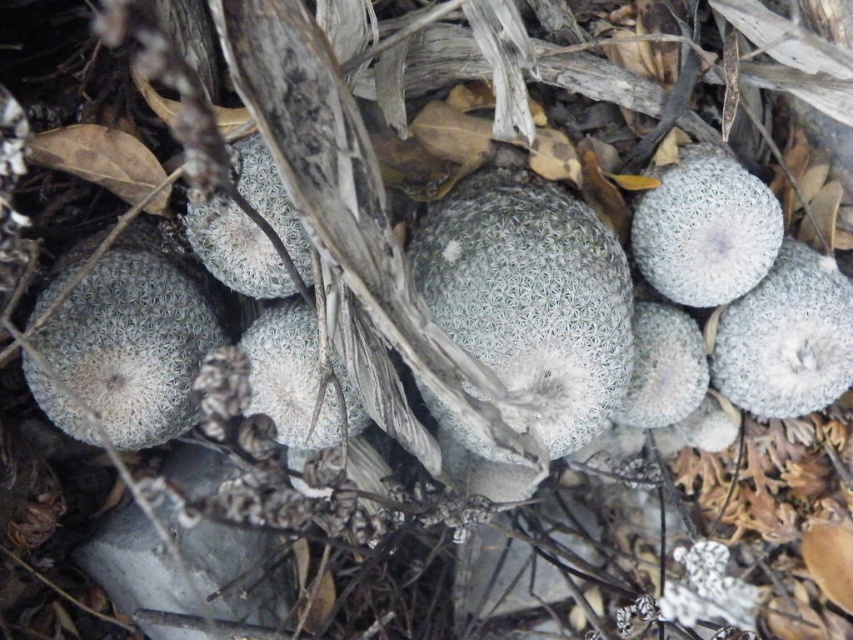
Looking at this image, who is lower down, white fuzzy cactus at center or white fuzzy cactus at upper right?

white fuzzy cactus at center is lower down.

Does white fuzzy cactus at center have a greater width compared to white fuzzy cactus at upper right?

Yes.

Image resolution: width=853 pixels, height=640 pixels. I want to click on white fuzzy cactus at center, so click(x=531, y=298).

Find the location of a particular element. white fuzzy cactus at center is located at coordinates (531, 298).

Does white fuzzy cactus at left have a lesser width compared to gray fuzzy cactus at right?

In fact, white fuzzy cactus at left might be wider than gray fuzzy cactus at right.

What do you see at coordinates (135, 340) in the screenshot? I see `white fuzzy cactus at left` at bounding box center [135, 340].

Where is `white fuzzy cactus at left`? white fuzzy cactus at left is located at coordinates (135, 340).

Does white fuzzy cactus at center have a larger size compared to white fuzzy cactus at left?

Correct, white fuzzy cactus at center is larger in size than white fuzzy cactus at left.

Who is positioned more to the left, white fuzzy cactus at center or white fuzzy cactus at left?

From the viewer's perspective, white fuzzy cactus at left appears more on the left side.

In the scene shown: Who is more distant from viewer, (419, 385) or (178, 388)?

The point (178, 388) is more distant.

Identify the location of white fuzzy cactus at center. The height and width of the screenshot is (640, 853). (531, 298).